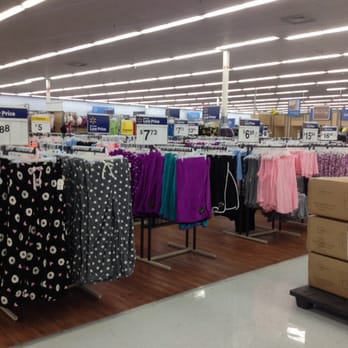
Identify the location of cardboard boxes. Image resolution: width=348 pixels, height=348 pixels. (320, 188), (323, 231), (320, 268).